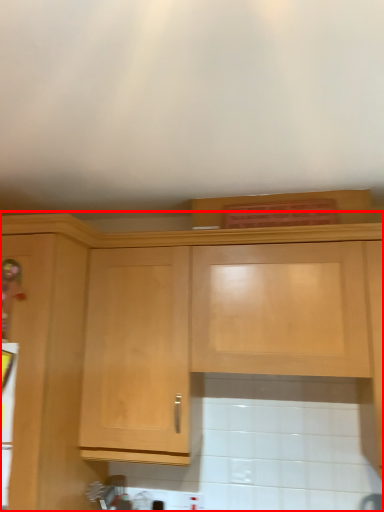
Question: From the image, what is the correct spatial relationship of cabinetry (annotated by the red box) in relation to appliance?

Choices:
 (A) left
 (B) right

Answer: (B)